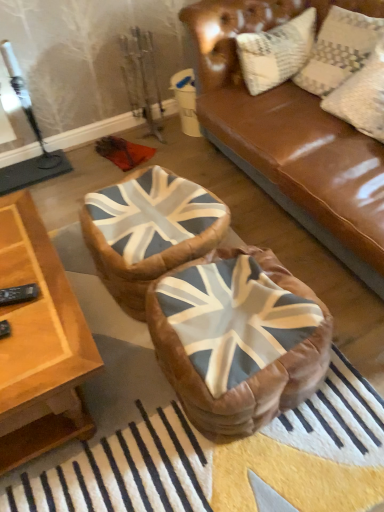
Question: Which is correct: leather union jack bean bag at center, the 1th bean bag chair viewed from the back, is inside leather bean bag at center, acting as the first bean bag chair starting from the front, or outside of it?

Choices:
 (A) inside
 (B) outside

Answer: (B)

Question: In the image, is leather union jack bean bag at center, which is the second bean bag chair in front-to-back order, positioned in front of or behind leather bean bag at center, positioned as the 2th bean bag chair in back-to-front order?

Choices:
 (A) behind
 (B) front

Answer: (A)

Question: Estimate the real-world distances between objects in this image. Which object is farther from the leather union jack bean bag at center, which is the second bean bag chair in front-to-back order?

Choices:
 (A) leather bean bag at center, positioned as the 2th bean bag chair in back-to-front order
 (B) wooden table at lower left
 (C) textured cream pillow at upper right

Answer: (C)

Question: Estimate the real-world distances between objects in this image. Which object is farther from the wooden table at lower left?

Choices:
 (A) leather union jack bean bag at center, the 1th bean bag chair viewed from the back
 (B) leather bean bag at center, positioned as the 2th bean bag chair in back-to-front order
 (C) textured cream pillow at upper right

Answer: (C)